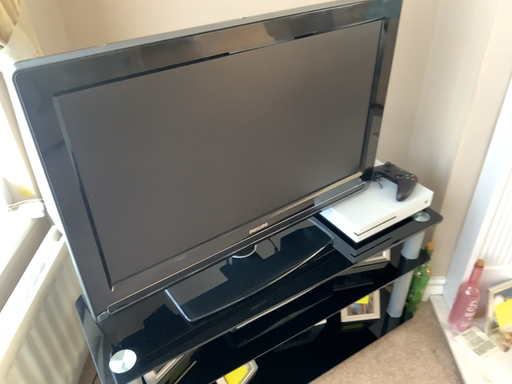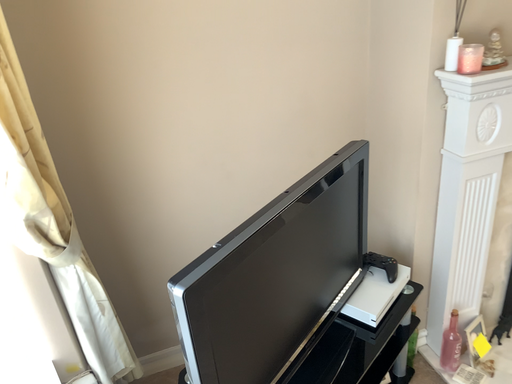
Question: How did the camera likely rotate when shooting the video?

Choices:
 (A) rotated right
 (B) rotated left

Answer: (A)